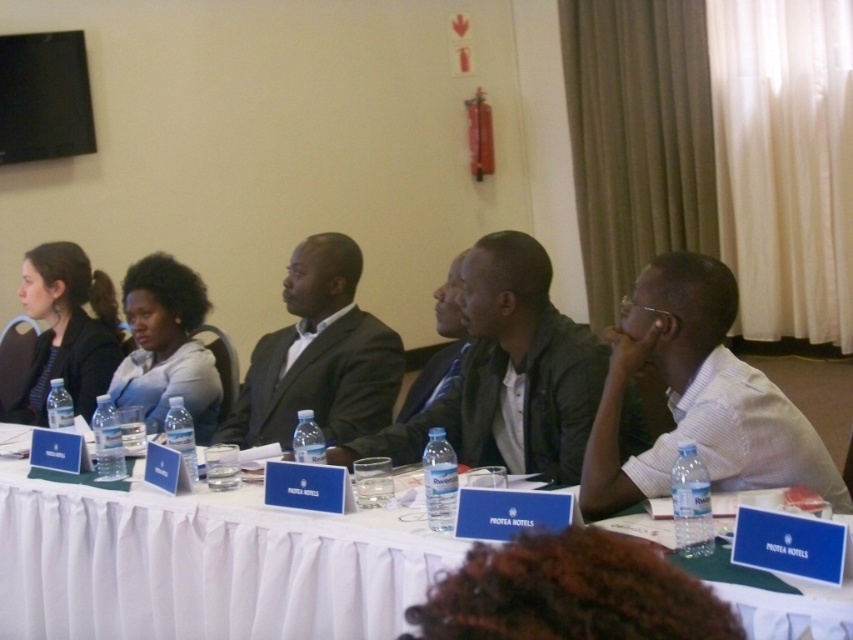
You are a photographer at the conference. You need to take a photo of the black suit at center and the matte black jacket at left. Which one appears shorter in the photo?

The black suit at center appears shorter than the matte black jacket at left in the photo because the black suit at center is not as tall as matte black jacket at left.

You are attending a professional meeting and need to locate two attendees wearing black attire. The black suit at center and the matte black jacket at left are both present. Which one is positioned to the right side of the other?

The black suit at center is to the right of matte black jacket at left.